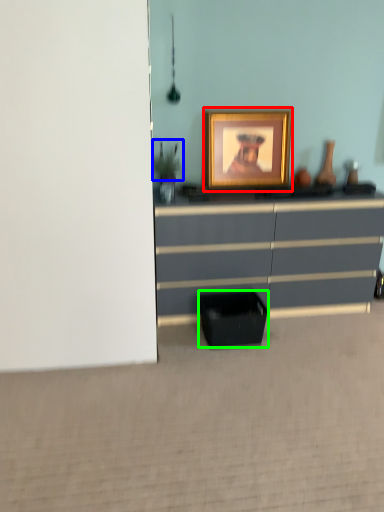
Question: Which object is the farthest from picture frame (highlighted by a red box)? Choose among these: plant (highlighted by a blue box) or cabinetry (highlighted by a green box).

Choices:
 (A) plant
 (B) cabinetry

Answer: (B)